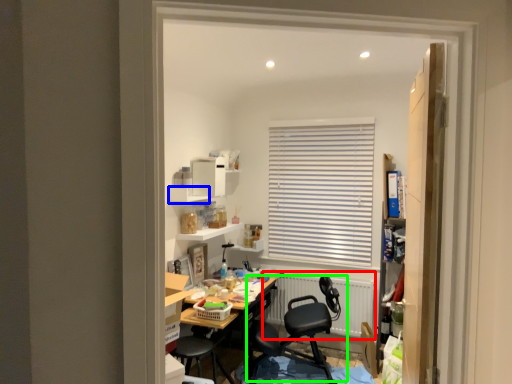
Question: Which object is positioned farthest from radiator (highlighted by a red box)? Select from shelf (highlighted by a blue box) and chair (highlighted by a green box).

Choices:
 (A) shelf
 (B) chair

Answer: (A)